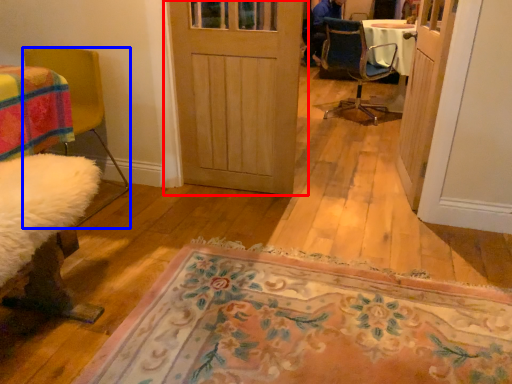
Question: Which object appears farthest to the camera in this image, door (highlighted by a red box) or chair (highlighted by a blue box)?

Choices:
 (A) door
 (B) chair

Answer: (A)